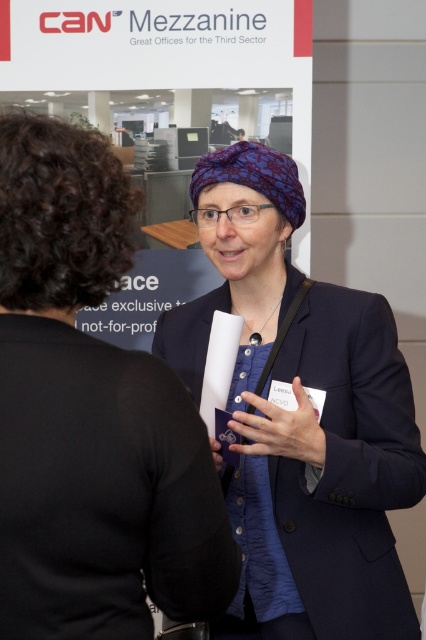
Is blue textured scarf at center thinner than blue fabric headscarf at center?

Correct, blue textured scarf at center's width is less than blue fabric headscarf at center's.

Is blue textured scarf at center shorter than blue fabric headscarf at center?

Correct, blue textured scarf at center is not as tall as blue fabric headscarf at center.

Which is behind, point (210, 502) or point (408, 388)?

Positioned behind is point (408, 388).

At what (x,y) coordinates should I click in order to perform the action: click on blue textured scarf at center. Please return your answer as a coordinate pair (x, y). The width and height of the screenshot is (426, 640). Looking at the image, I should click on click(x=91, y=416).